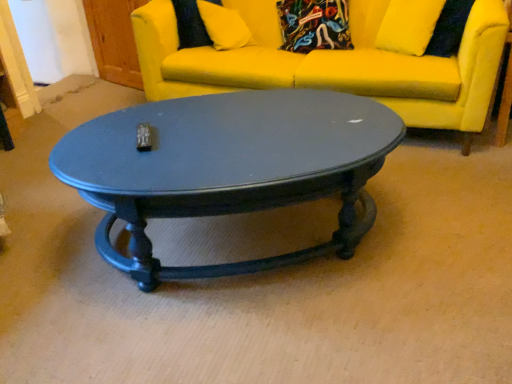
Image resolution: width=512 pixels, height=384 pixels. I want to click on free point to the right of matte black coffee table at center, so click(444, 220).